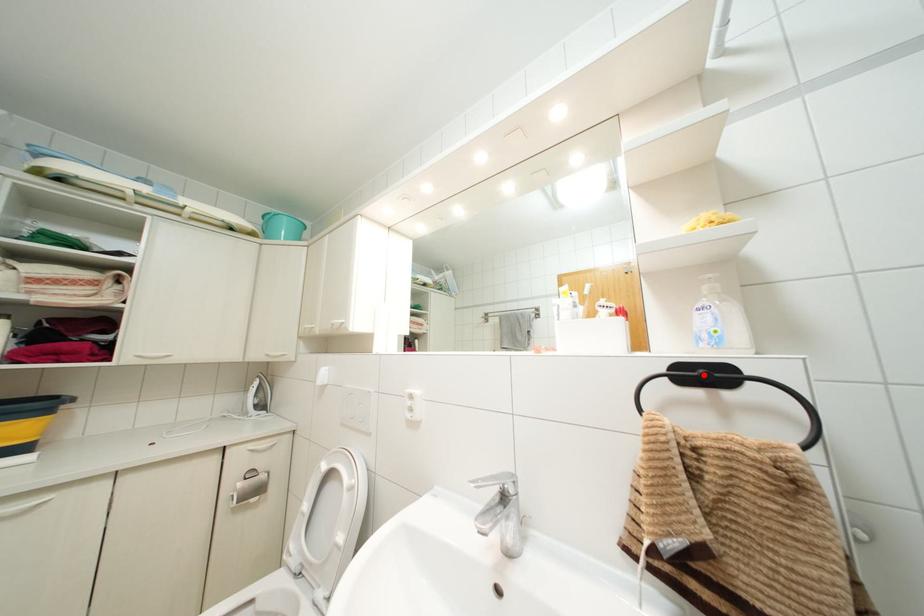
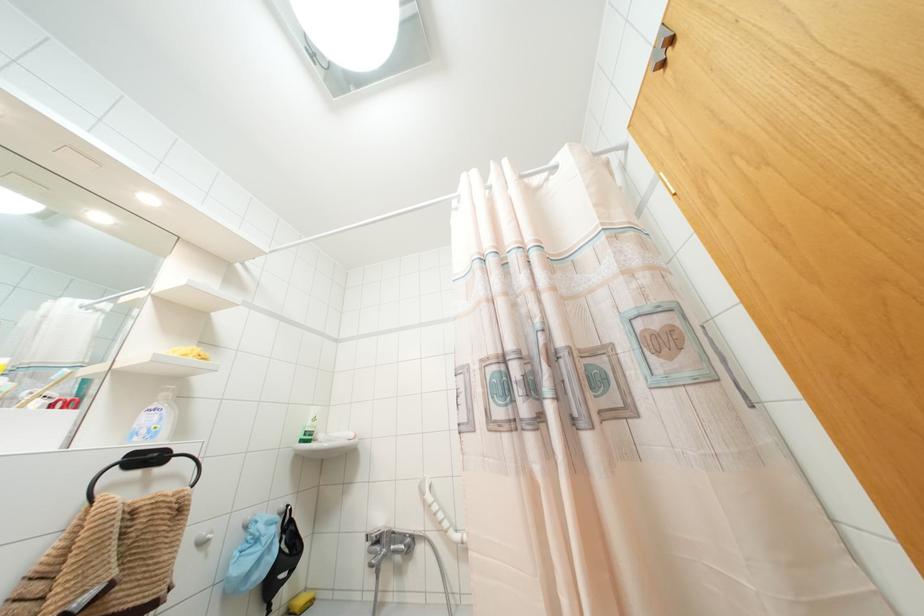
The point at the highlighted location is marked in the first image. Where is the corresponding point in the second image?

(147, 458)